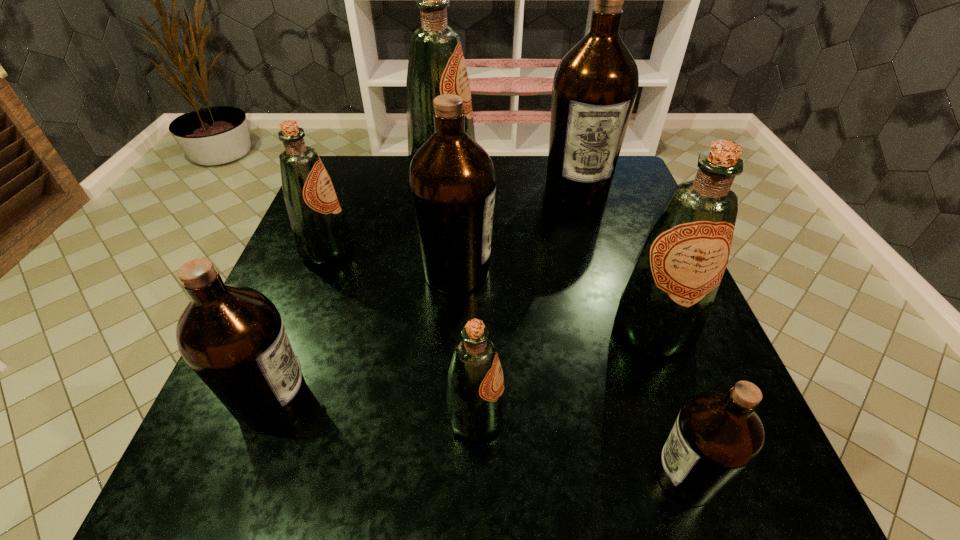
Select which object appears as the closest to the third nearest brown olive oil. Please provide its 2D coordinates. Your answer should be formatted as a tuple, i.e. [(x, y)], where the tuple contains the x and y coordinates of a point satisfying the conditions above.

[(321, 234)]

This screenshot has width=960, height=540. I want to click on object that stands as the seventh closest to the second smallest brown olive oil, so click(x=595, y=85).

Select which olive oil is the fourth closest to the rightmost green olive oil. Please provide its 2D coordinates. Your answer should be formatted as a tuple, i.e. [(x, y)], where the tuple contains the x and y coordinates of a point satisfying the conditions above.

[(595, 85)]

Locate which olive oil ranks third in proximity to the third nearest green olive oil. Please provide its 2D coordinates. Your answer should be formatted as a tuple, i.e. [(x, y)], where the tuple contains the x and y coordinates of a point satisfying the conditions above.

[(233, 337)]

Select which green olive oil is the third closest to the third biggest green olive oil. Please provide its 2D coordinates. Your answer should be formatted as a tuple, i.e. [(x, y)], where the tuple contains the x and y coordinates of a point satisfying the conditions above.

[(664, 305)]

Point out which green olive oil is positioned as the second nearest to the second biggest green olive oil. Please provide its 2D coordinates. Your answer should be formatted as a tuple, i.e. [(x, y)], where the tuple contains the x and y coordinates of a point satisfying the conditions above.

[(436, 66)]

Identify the location of the second closest brown olive oil to the third nearest green olive oil. (233, 337).

Point out which brown olive oil is positioned as the third nearest to the biggest green olive oil. Please provide its 2D coordinates. Your answer should be formatted as a tuple, i.e. [(x, y)], where the tuple contains the x and y coordinates of a point satisfying the conditions above.

[(233, 337)]

Locate an element on the screen. The height and width of the screenshot is (540, 960). free space that satisfies the following two spatial constraints: 1. on the label of the biggest brown olive oil; 2. on the label of the third brown olive oil from right to left is located at coordinates (601, 272).

This screenshot has height=540, width=960. I want to click on free space that satisfies the following two spatial constraints: 1. on the front-facing side of the third smallest green olive oil; 2. on the label of the nearest brown olive oil, so click(708, 476).